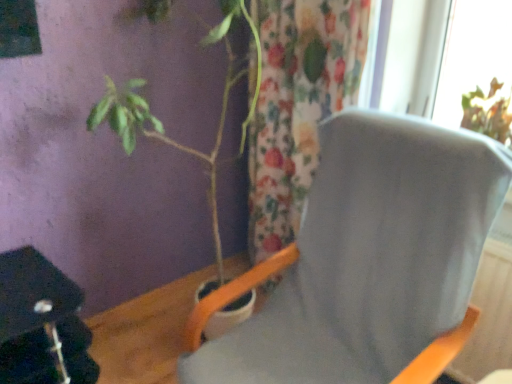
Describe the element at coordinates (163, 127) in the screenshot. This screenshot has height=384, width=512. I see `green matte plant at left` at that location.

The width and height of the screenshot is (512, 384). What do you see at coordinates (229, 295) in the screenshot? I see `gray fabric chair at center` at bounding box center [229, 295].

The height and width of the screenshot is (384, 512). What are the coordinates of `floral fabric curtain at center` in the screenshot? It's located at pos(297,105).

Which object is more forward, green matte plant at left or gray fabric chair at center?

gray fabric chair at center is in front.

Considering the positions of objects green matte plant at left and gray fabric chair at center in the image provided, who is more to the left, green matte plant at left or gray fabric chair at center?

green matte plant at left is more to the left.

Is green matte plant at left wider than gray fabric chair at center?

In fact, green matte plant at left might be narrower than gray fabric chair at center.

Is green matte plant at left not near gray fabric chair at center?

Actually, green matte plant at left and gray fabric chair at center are a little close together.

Is floral fabric curtain at center located outside gray fabric chair at center?

Yes.

From the image's perspective, is floral fabric curtain at center below gray fabric chair at center?

Actually, floral fabric curtain at center appears above gray fabric chair at center in the image.

Could you tell me if floral fabric curtain at center is turned towards gray fabric chair at center?

No, floral fabric curtain at center is not aimed at gray fabric chair at center.

Find the location of a particular element. The height and width of the screenshot is (384, 512). chair in front of the floral fabric curtain at center is located at coordinates (229, 295).

Looking at their sizes, would you say gray fabric chair at center is wider or thinner than floral fabric curtain at center?

Considering their sizes, gray fabric chair at center looks broader than floral fabric curtain at center.

Find the location of `curtain behind the gray fabric chair at center`. curtain behind the gray fabric chair at center is located at coordinates (297, 105).

Measure the distance from gray fabric chair at center to floral fabric curtain at center.

gray fabric chair at center is 21.02 inches away from floral fabric curtain at center.

Which is correct: gray fabric chair at center is inside floral fabric curtain at center, or outside of it?

gray fabric chair at center is spatially situated outside floral fabric curtain at center.

How different are the orientations of green matte plant at left and floral fabric curtain at center in degrees?

The angular difference between green matte plant at left and floral fabric curtain at center is 91.7 degrees.

Considering the sizes of objects green matte plant at left and floral fabric curtain at center in the image provided, who is shorter, green matte plant at left or floral fabric curtain at center?

Standing shorter between the two is green matte plant at left.

Does point (134, 119) lie in front of point (319, 32)?

Yes, it is in front of point (319, 32).

How distant is floral fabric curtain at center from green matte plant at left?

13.23 inches.

Considering the relative sizes of floral fabric curtain at center and green matte plant at left in the image provided, is floral fabric curtain at center wider than green matte plant at left?

In fact, floral fabric curtain at center might be narrower than green matte plant at left.

From a real-world perspective, is floral fabric curtain at center physically above green matte plant at left?

Yes, from a real-world perspective, floral fabric curtain at center is above green matte plant at left.

Find the location of `houseplant located underneath the floral fabric curtain at center (from a real-world perspective)`. houseplant located underneath the floral fabric curtain at center (from a real-world perspective) is located at coordinates (163, 127).

Is gray fabric chair at center in contact with green matte plant at left?

No, gray fabric chair at center is not with green matte plant at left.

From the picture: Is gray fabric chair at center further to camera compared to green matte plant at left?

No, gray fabric chair at center is closer to the camera.

Is green matte plant at left located within gray fabric chair at center?

No, green matte plant at left is not a part of gray fabric chair at center.

Where is `chair in front of the green matte plant at left`? This screenshot has height=384, width=512. chair in front of the green matte plant at left is located at coordinates (229, 295).

This screenshot has height=384, width=512. I want to click on chair that is under the floral fabric curtain at center (from a real-world perspective), so click(229, 295).

From the image, which object appears to be nearer to gray fabric chair at center, green matte plant at left or floral fabric curtain at center?

green matte plant at left lies closer to gray fabric chair at center than the other object.

Estimate the real-world distances between objects in this image. Which object is closer to floral fabric curtain at center, green matte plant at left or gray fabric chair at center?

green matte plant at left is closer to floral fabric curtain at center.

Considering their positions, is floral fabric curtain at center positioned further to green matte plant at left than gray fabric chair at center?

Among the two, gray fabric chair at center is located further to green matte plant at left.

Looking at the image, which one is located further to gray fabric chair at center, floral fabric curtain at center or green matte plant at left?

floral fabric curtain at center lies further to gray fabric chair at center than the other object.

Which object lies further to the anchor point floral fabric curtain at center, gray fabric chair at center or green matte plant at left?

gray fabric chair at center lies further to floral fabric curtain at center than the other object.

Considering their positions, is gray fabric chair at center positioned further to green matte plant at left than floral fabric curtain at center?

gray fabric chair at center lies further to green matte plant at left than the other object.

The height and width of the screenshot is (384, 512). I want to click on houseplant positioned between gray fabric chair at center and floral fabric curtain at center from near to far, so click(163, 127).